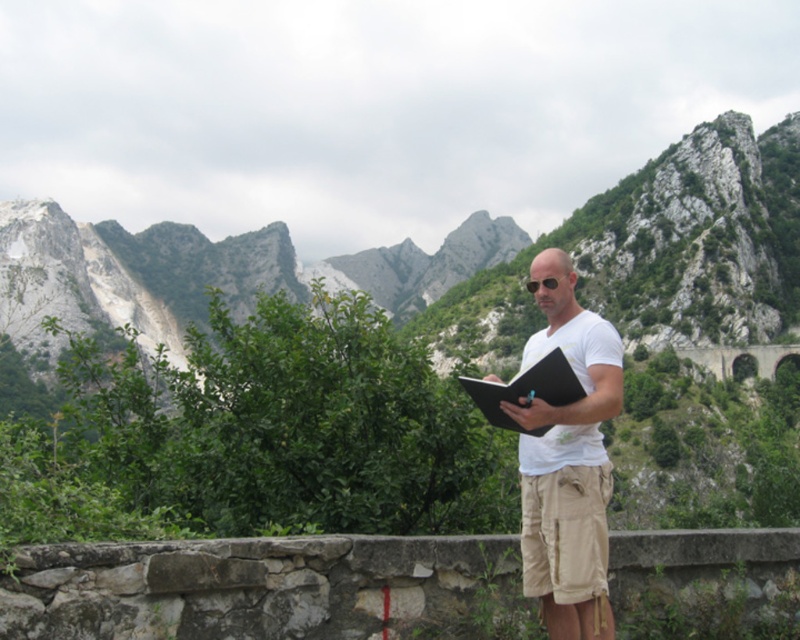
Question: Which point appears closest to the camera in this image?

Choices:
 (A) (558, 627)
 (B) (526, 476)

Answer: (A)

Question: Which of the following is the closest to the observer?

Choices:
 (A) (564, 476)
 (B) (721, 200)
 (C) (596, 564)
 (D) (510, 401)

Answer: (C)

Question: Which of the following is the farthest from the observer?

Choices:
 (A) rugged stone mountain at center
 (B) tan cotton shorts at center
 (C) white cotton shirt at center

Answer: (A)

Question: Is white cotton shirt at center further to camera compared to black matte notebook at center?

Choices:
 (A) no
 (B) yes

Answer: (A)

Question: Can you confirm if white cotton shirt at center is positioned to the left of black matte notebook at center?

Choices:
 (A) no
 (B) yes

Answer: (A)

Question: Is white cotton shirt at center to the left of black matte notebook at center from the viewer's perspective?

Choices:
 (A) yes
 (B) no

Answer: (B)